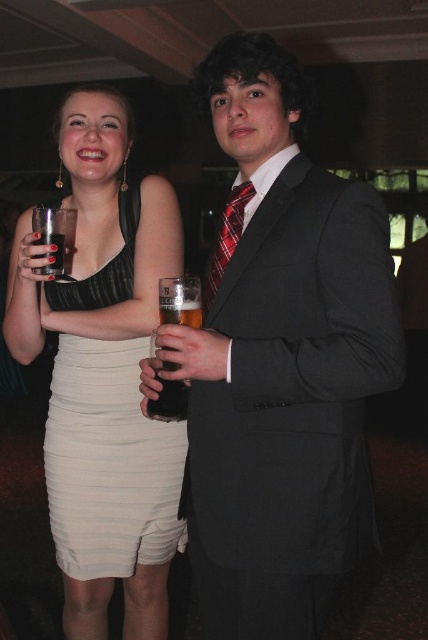
Question: In this image, where is white satin dress at center located relative to red plaid tie at center?

Choices:
 (A) right
 (B) left

Answer: (B)

Question: Which of these objects is positioned closest to the red plaid tie at center?

Choices:
 (A) clear glass at upper left
 (B) white satin dress at center

Answer: (A)

Question: Is white satin dress at center bigger than clear glass at upper left?

Choices:
 (A) yes
 (B) no

Answer: (A)

Question: Can you confirm if white satin dress at center is thinner than clear glass at upper left?

Choices:
 (A) no
 (B) yes

Answer: (A)

Question: Which of the following is the farthest from the observer?

Choices:
 (A) white satin dress at center
 (B) red plaid tie at center
 (C) matte black suit at center
 (D) clear glass at upper left

Answer: (A)

Question: Which point is farther to the camera?

Choices:
 (A) [x=133, y=266]
 (B) [x=61, y=259]
 (C) [x=357, y=316]

Answer: (A)